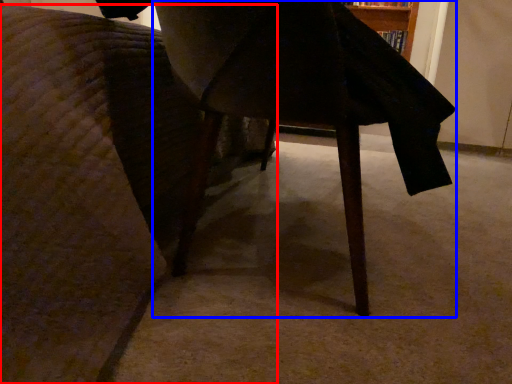
Question: Which object appears farthest to the camera in this image, furniture (highlighted by a red box) or table (highlighted by a blue box)?

Choices:
 (A) furniture
 (B) table

Answer: (B)